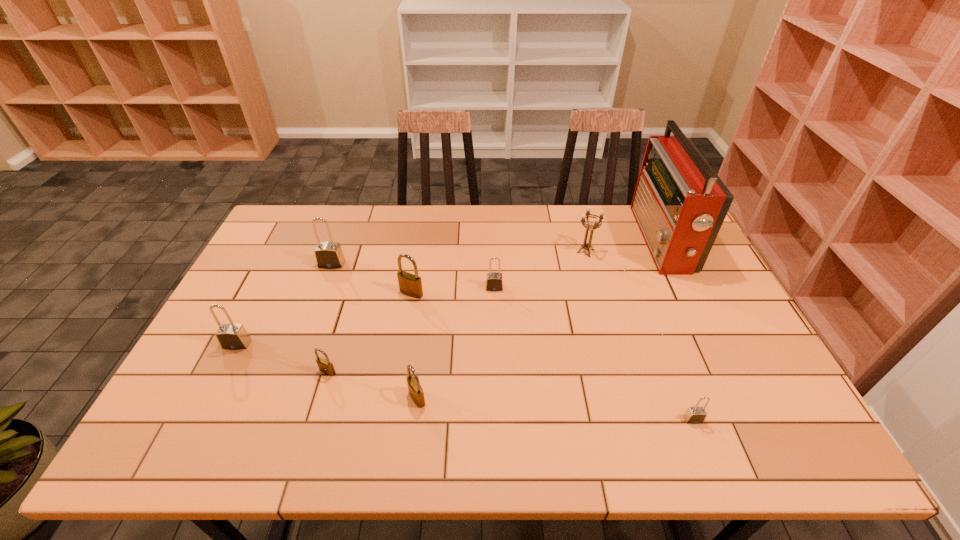
The height and width of the screenshot is (540, 960). What are the coordinates of `the nearest brass padlock` in the screenshot? It's located at coord(416,392).

In order to click on the second nearest padlock in this screenshot , I will do point(416,392).

Identify the location of the nearest padlock. (694, 415).

Image resolution: width=960 pixels, height=540 pixels. Identify the location of the eighth object from left to right. (694, 415).

What are the coordinates of `the fifth padlock from right to left` in the screenshot? It's located at (325, 366).

Find the location of a particular element. The image size is (960, 540). the seventh object from right to left is located at coordinates click(325, 366).

Where is `vacant position located 0.180m on the front-facing side of the rightmost object`? The height and width of the screenshot is (540, 960). vacant position located 0.180m on the front-facing side of the rightmost object is located at coordinates (588, 240).

Find the location of `free space located 0.210m on the front-facing side of the rightmost object`. free space located 0.210m on the front-facing side of the rightmost object is located at coordinates (579, 240).

Identify the location of vacant space located 0.350m on the front-facing side of the rightmost object. The image size is (960, 540). (538, 240).

In order to click on vacant region located 0.200m on the shackle of the second padlock from left to right in this screenshot , I will do `click(312, 316)`.